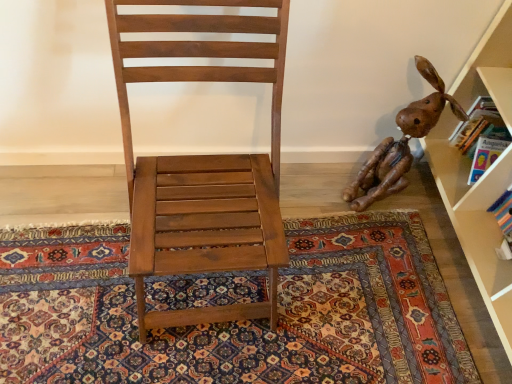
Find the location of a particular element. free point in front of matte wood chair at center is located at coordinates (150, 351).